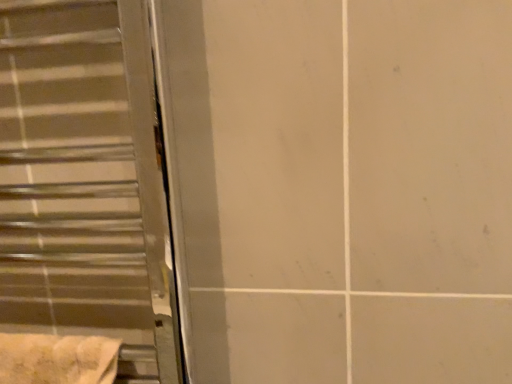
Where is `beige textured towel at lower left`? beige textured towel at lower left is located at coordinates (57, 359).

This screenshot has width=512, height=384. What do you see at coordinates (57, 359) in the screenshot?
I see `beige textured towel at lower left` at bounding box center [57, 359].

You are a GUI agent. You are given a task and a screenshot of the screen. Output one action in this format:
    pyautogui.click(x=<x>, y=<y>)
    Task: Click on the beige textured towel at lower left
    The height and width of the screenshot is (384, 512).
    Given the screenshot: What is the action you would take?
    pyautogui.click(x=57, y=359)